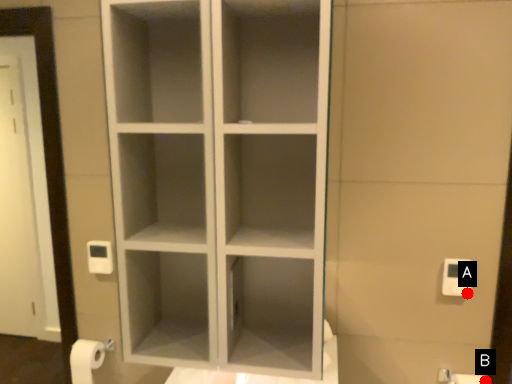
Question: Two points are circled on the image, labeled by A and B beside each circle. Which point is further to the camera?

Choices:
 (A) A is further
 (B) B is further

Answer: (B)